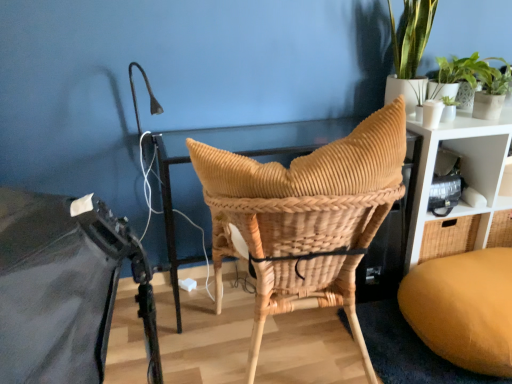
Find the location of a particular element. green leafy plant at upper right, the first houseplant when ordered from left to right is located at coordinates (410, 51).

How much space does green leafy plant at upper right, which appears as the second houseplant when viewed from the left, occupy vertically?

The height of green leafy plant at upper right, which appears as the second houseplant when viewed from the left, is 10.22 inches.

The image size is (512, 384). I want to click on green leafy plant at upper right, which is counted as the 2th houseplant, starting from the right, so click(410, 51).

Between green leafy plant at upper right, which appears as the second houseplant when viewed from the left, and velvet mustard bean bag at lower right, which one appears on the left side from the viewer's perspective?

Positioned to the left is velvet mustard bean bag at lower right.

Where is `bean bag chair located below the green leafy plant at upper right, which appears as the second houseplant when viewed from the left (from the image's perspective)`? This screenshot has height=384, width=512. bean bag chair located below the green leafy plant at upper right, which appears as the second houseplant when viewed from the left (from the image's perspective) is located at coordinates (463, 309).

Considering the positions of point (475, 53) and point (439, 328), is point (475, 53) closer or farther from the camera than point (439, 328)?

Point (475, 53) is positioned farther from the camera compared to point (439, 328).

Is green leafy plant at upper right, which appears as the second houseplant when viewed from the left, thinner than velvet mustard bean bag at lower right?

Correct, the width of green leafy plant at upper right, which appears as the second houseplant when viewed from the left, is less than that of velvet mustard bean bag at lower right.

Where is `shelf that is the 2nd one above the velvet mustard bean bag at lower right (from a real-world perspective)`? The height and width of the screenshot is (384, 512). shelf that is the 2nd one above the velvet mustard bean bag at lower right (from a real-world perspective) is located at coordinates (482, 165).

Is velvet mustard bean bag at lower right placed right next to white matte shelf at right, the second shelf in the bottom-to-top sequence?

No, velvet mustard bean bag at lower right is not making contact with white matte shelf at right, the second shelf in the bottom-to-top sequence.

Consider the image. Does velvet mustard bean bag at lower right have a larger size compared to white matte shelf at right, the first shelf viewed from the top?

Yes.

From the image's perspective, which is below, velvet mustard bean bag at lower right or white matte shelf at right, the second shelf in the bottom-to-top sequence?

velvet mustard bean bag at lower right, from the image's perspective.

This screenshot has height=384, width=512. I want to click on shelf that appears on the left of white woven shelf at upper right, marked as the second shelf in a top-to-bottom arrangement, so click(482, 165).

Is white woven shelf at upper right, the 1th shelf when ordered from bottom to top, with white matte shelf at right, the second shelf in the bottom-to-top sequence?

Yes, white woven shelf at upper right, the 1th shelf when ordered from bottom to top, is right next to white matte shelf at right, the second shelf in the bottom-to-top sequence, and making contact.

From the image's perspective, which is below, white woven shelf at upper right, marked as the second shelf in a top-to-bottom arrangement, or white matte shelf at right, the second shelf in the bottom-to-top sequence?

From the image's view, white woven shelf at upper right, marked as the second shelf in a top-to-bottom arrangement, is below.

From a real-world perspective, is white woven shelf at upper right, the 1th shelf when ordered from bottom to top, positioned over white matte shelf at right, the second shelf in the bottom-to-top sequence, based on gravity?

No, from a real-world perspective, white woven shelf at upper right, the 1th shelf when ordered from bottom to top, is not on top of white matte shelf at right, the second shelf in the bottom-to-top sequence.

Who is bigger, white matte shelf at right, the second shelf in the bottom-to-top sequence, or woven rattan basket at center?

With larger size is white matte shelf at right, the second shelf in the bottom-to-top sequence.

How many degrees apart are the facing directions of white matte shelf at right, the first shelf viewed from the top, and woven rattan basket at center?

white matte shelf at right, the first shelf viewed from the top, and woven rattan basket at center are facing 173 degrees away from each other.

Is white matte shelf at right, the second shelf in the bottom-to-top sequence, facing towards woven rattan basket at center?

No, white matte shelf at right, the second shelf in the bottom-to-top sequence, is not facing towards woven rattan basket at center.

Can you confirm if white matte shelf at right, the second shelf in the bottom-to-top sequence, is positioned to the left of woven rattan basket at center?

Incorrect, white matte shelf at right, the second shelf in the bottom-to-top sequence, is not on the left side of woven rattan basket at center.

Is point (483, 166) closer or farther from the camera than point (499, 367)?

Clearly, point (483, 166) is more distant from the camera than point (499, 367).

Can you tell me how much white matte shelf at right, the second shelf in the bottom-to-top sequence, and velvet mustard bean bag at lower right differ in facing direction?

white matte shelf at right, the second shelf in the bottom-to-top sequence, and velvet mustard bean bag at lower right are facing 88.9 degrees away from each other.

Does white matte shelf at right, the first shelf viewed from the top, have a greater height compared to velvet mustard bean bag at lower right?

Yes.

Which is correct: white matte shelf at right, the first shelf viewed from the top, is inside velvet mustard bean bag at lower right, or outside of it?

white matte shelf at right, the first shelf viewed from the top, exists outside the volume of velvet mustard bean bag at lower right.

Which is behind, point (419, 175) or point (461, 73)?

The point (461, 73) is farther from the camera.

Does white woven shelf at upper right, the 1th shelf when ordered from bottom to top, have a smaller size compared to green leafy plant at upper right, which appears as the second houseplant when viewed from the left?

No, white woven shelf at upper right, the 1th shelf when ordered from bottom to top, is not smaller than green leafy plant at upper right, which appears as the second houseplant when viewed from the left.

There is a white woven shelf at upper right, the 1th shelf when ordered from bottom to top. What are the coordinates of `the 1st houseplant above it (from the image's perspective)` in the screenshot? It's located at (473, 74).

From a real-world perspective, is white woven shelf at upper right, marked as the second shelf in a top-to-bottom arrangement, under green leafy plant at upper right, the 1th houseplant when ordered from right to left?

Yes, from a real-world perspective, white woven shelf at upper right, marked as the second shelf in a top-to-bottom arrangement, is beneath green leafy plant at upper right, the 1th houseplant when ordered from right to left.

Between natural woven chair at center and woven rattan basket at center, which one has smaller size?

With smaller size is woven rattan basket at center.

Where is `chair on the left of woven rattan basket at center`? chair on the left of woven rattan basket at center is located at coordinates (304, 218).

Is the position of natural woven chair at center less distant than that of woven rattan basket at center?

That is True.

Can you tell me how much natural woven chair at center and woven rattan basket at center differ in facing direction?

The angular difference between natural woven chair at center and woven rattan basket at center is 0.000172 degrees.

Find the location of a particular element. The image size is (512, 384). houseplant that is the 1st one when counting upward from the velvet mustard bean bag at lower right (from the image's perspective) is located at coordinates (473, 74).

At what (x,y) coordinates should I click in order to perform the action: click on the 2nd shelf behind the velvet mustard bean bag at lower right, starting your count from the anchor. Please return your answer as a coordinate pair (x, y). This screenshot has height=384, width=512. Looking at the image, I should click on (482, 165).

From the image, which object appears to be nearer to white woven shelf at upper right, marked as the second shelf in a top-to-bottom arrangement, natural woven chair at center or velvet mustard bean bag at lower right?

Based on the image, velvet mustard bean bag at lower right appears to be nearer to white woven shelf at upper right, marked as the second shelf in a top-to-bottom arrangement.

Which object lies nearer to the anchor point white woven shelf at upper right, marked as the second shelf in a top-to-bottom arrangement, velvet mustard bean bag at lower right or woven rattan basket at center?

velvet mustard bean bag at lower right is positioned closer to the anchor white woven shelf at upper right, marked as the second shelf in a top-to-bottom arrangement.

In the scene shown: Looking at the image, which one is located closer to green leafy plant at upper right, the 1th houseplant when ordered from right to left, velvet mustard bean bag at lower right or white woven shelf at upper right, marked as the second shelf in a top-to-bottom arrangement?

The object closer to green leafy plant at upper right, the 1th houseplant when ordered from right to left, is white woven shelf at upper right, marked as the second shelf in a top-to-bottom arrangement.

From the image, which object appears to be farther from woven rattan basket at center, green leafy plant at upper right, the first houseplant when ordered from left to right, or natural woven chair at center?

green leafy plant at upper right, the first houseplant when ordered from left to right.

Based on their spatial positions, is white matte shelf at right, the first shelf viewed from the top, or woven rattan basket at center closer to velvet mustard bean bag at lower right?

Among the two, white matte shelf at right, the first shelf viewed from the top, is located nearer to velvet mustard bean bag at lower right.

Based on the photo, considering their positions, is woven rattan basket at center positioned further to natural woven chair at center than green leafy plant at upper right, the 1th houseplant when ordered from right to left?

Based on the image, green leafy plant at upper right, the 1th houseplant when ordered from right to left, appears to be further to natural woven chair at center.

Based on their spatial positions, is white matte shelf at right, the second shelf in the bottom-to-top sequence, or green leafy plant at upper right, the 1th houseplant when ordered from right to left, further from natural woven chair at center?

green leafy plant at upper right, the 1th houseplant when ordered from right to left, is further to natural woven chair at center.

In the scene shown: From the image, which object appears to be nearer to white matte shelf at right, the second shelf in the bottom-to-top sequence, natural woven chair at center or green leafy plant at upper right, which appears as the second houseplant when viewed from the left?

green leafy plant at upper right, which appears as the second houseplant when viewed from the left, lies closer to white matte shelf at right, the second shelf in the bottom-to-top sequence, than the other object.

Where is `houseplant situated between natural woven chair at center and green leafy plant at upper right, which appears as the second houseplant when viewed from the left, from left to right`? The width and height of the screenshot is (512, 384). houseplant situated between natural woven chair at center and green leafy plant at upper right, which appears as the second houseplant when viewed from the left, from left to right is located at coordinates (410, 51).

I want to click on basket between natural woven chair at center and white matte shelf at right, the first shelf viewed from the top, from left to right, so pos(298,245).

Identify the location of shelf between natural woven chair at center and velvet mustard bean bag at lower right in the horizontal direction. (482, 165).

You are a GUI agent. You are given a task and a screenshot of the screen. Output one action in this format:
    pyautogui.click(x=<x>, y=<y>)
    Task: Click on the bean bag chair between natural woven chair at center and green leafy plant at upper right, which appears as the second houseplant when viewed from the left, in the horizontal direction
    This screenshot has height=384, width=512.
    Given the screenshot: What is the action you would take?
    pyautogui.click(x=463, y=309)